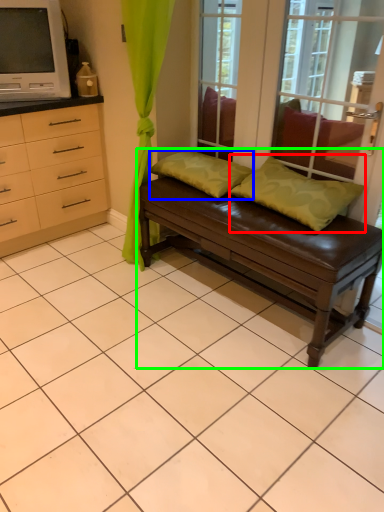
Question: Which object is positioned farthest from pillow (highlighted by a red box)? Select from pillow (highlighted by a blue box) and studio couch (highlighted by a green box).

Choices:
 (A) pillow
 (B) studio couch

Answer: (A)